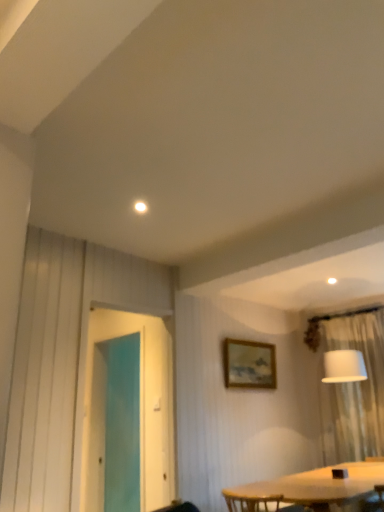
Question: Is white sheer curtain at right to the left or to the right of wooden frame at upper center in the image?

Choices:
 (A) right
 (B) left

Answer: (A)

Question: Does point (362, 400) appear closer or farther from the camera than point (238, 352)?

Choices:
 (A) farther
 (B) closer

Answer: (A)

Question: Which of these objects is positioned farthest from the transparent glass screen door at left?

Choices:
 (A) wooden frame at upper center
 (B) white sheer curtain at right

Answer: (B)

Question: Based on their relative distances, which object is nearer to the wooden frame at upper center?

Choices:
 (A) transparent glass screen door at left
 (B) white sheer curtain at right

Answer: (A)